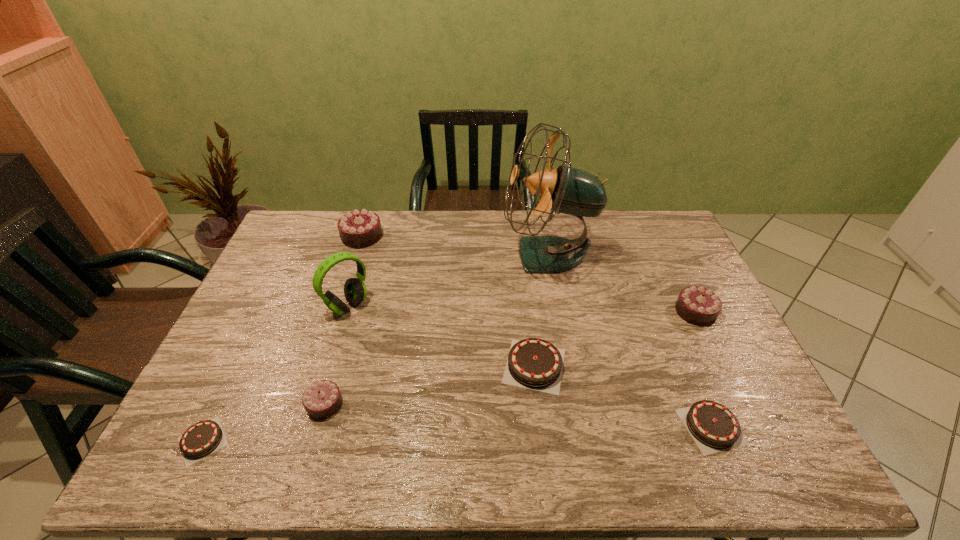
This screenshot has height=540, width=960. In order to click on vacant space at the far edge in this screenshot , I will do point(531,220).

Locate an element on the screen. free space at the near edge is located at coordinates (x=610, y=439).

This screenshot has height=540, width=960. Identify the location of vacant area at the left edge of the desktop. (285, 256).

Image resolution: width=960 pixels, height=540 pixels. What are the coordinates of `vacant area that lies between the fan and the rightmost chocolate chocolate cake` in the screenshot? It's located at (622, 284).

This screenshot has height=540, width=960. Identify the location of vacant area that lies between the leftmost brown chocolate cake and the farthest brown chocolate cake. (369, 403).

Where is `free space between the second tallest object and the sixth shortest object`? free space between the second tallest object and the sixth shortest object is located at coordinates (355, 271).

Find the location of a particular element. This screenshot has height=540, width=960. free space between the farthest brown chocolate cake and the second shortest chocolate cake is located at coordinates (623, 396).

The width and height of the screenshot is (960, 540). I want to click on free spot between the green headset and the smallest chocolate chocolate cake, so click(336, 355).

Where is `free spot between the farthest chocolate chocolate cake and the tallest object`? The image size is (960, 540). free spot between the farthest chocolate chocolate cake and the tallest object is located at coordinates (455, 246).

Locate an element on the screen. vacant area that lies between the biggest brown chocolate cake and the leftmost object is located at coordinates coord(369,403).